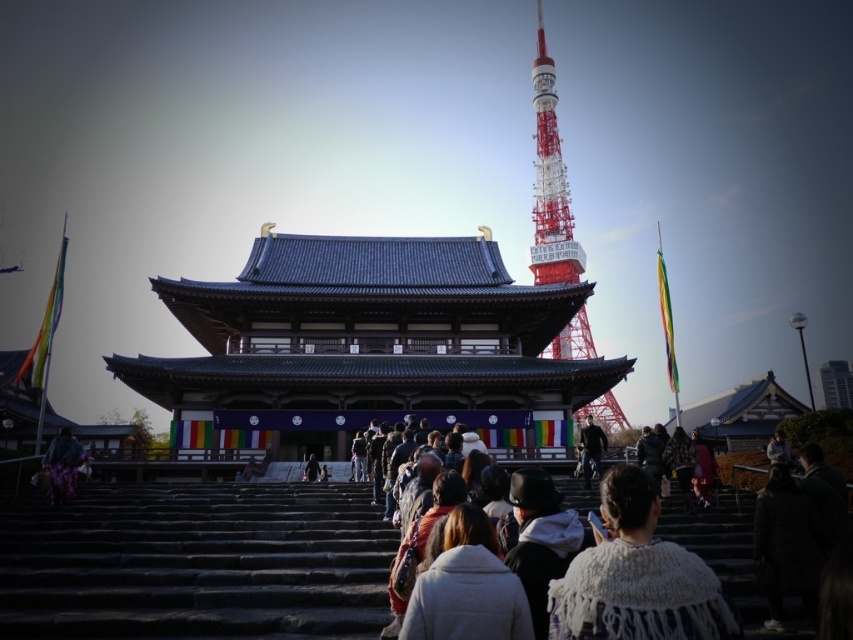
Question: Does white knitted shawl at center appear under red and white painted metal tower at upper center?

Choices:
 (A) yes
 (B) no

Answer: (A)

Question: Does dark stone stairs at center come behind white fuzzy jacket at center?

Choices:
 (A) no
 (B) yes

Answer: (B)

Question: Which of these objects is positioned farthest from the dark stone stairs at center?

Choices:
 (A) shiny blue pagoda at center
 (B) white knitted shawl at center
 (C) white fuzzy jacket at center

Answer: (A)

Question: Which is nearer to the red and white painted metal tower at upper center?

Choices:
 (A) dark stone stairs at center
 (B) white fuzzy jacket at center

Answer: (A)

Question: Which point appears farthest from the camera in this image?

Choices:
 (A) (627, 480)
 (B) (361, 260)

Answer: (B)

Question: Does dark stone stairs at center appear over red and white painted metal tower at upper center?

Choices:
 (A) yes
 (B) no

Answer: (B)